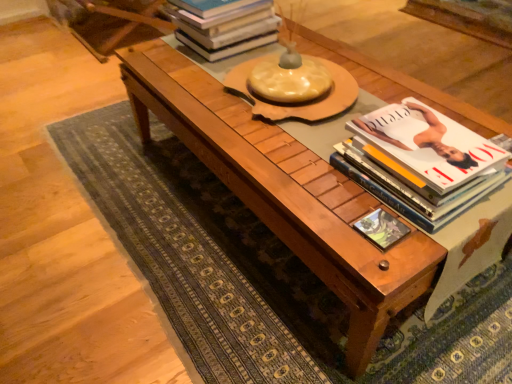
Locate an element on the screen. free space to the left of white glossy book at right, which is counted as the 1th book, starting from the front is located at coordinates (305, 170).